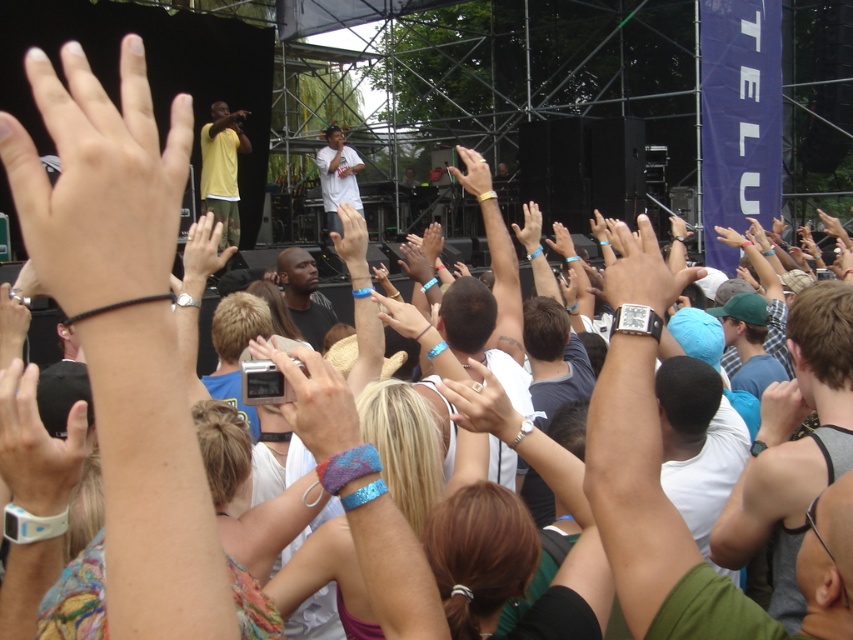
Which is above, white matte hand at upper left or matte black wristband at upper center?

matte black wristband at upper center is higher up.

Is white matte hand at upper left positioned in front of matte black wristband at upper center?

Yes, white matte hand at upper left is in front of matte black wristband at upper center.

Does point (115, 177) come farther from viewer compared to point (339, 209)?

No, it is not.

Find the location of a particular element. This screenshot has height=640, width=853. white matte hand at upper left is located at coordinates (97, 180).

Can you confirm if matte black wristband at upper center is thinner than matte black hand at center?

Incorrect, matte black wristband at upper center's width is not less than matte black hand at center's.

Can you confirm if matte black wristband at upper center is taller than matte black hand at center?

No.

Image resolution: width=853 pixels, height=640 pixels. What are the coordinates of `matte black wristband at upper center` in the screenshot? It's located at (349, 234).

Consider the image. Who is positioned more to the left, silver metallic camera at center or matte black hand at upper center?

Positioned to the left is matte black hand at upper center.

The height and width of the screenshot is (640, 853). In order to click on silver metallic camera at center in this screenshot , I will do `click(314, 400)`.

Find the location of a particular element. The height and width of the screenshot is (640, 853). silver metallic camera at center is located at coordinates (314, 400).